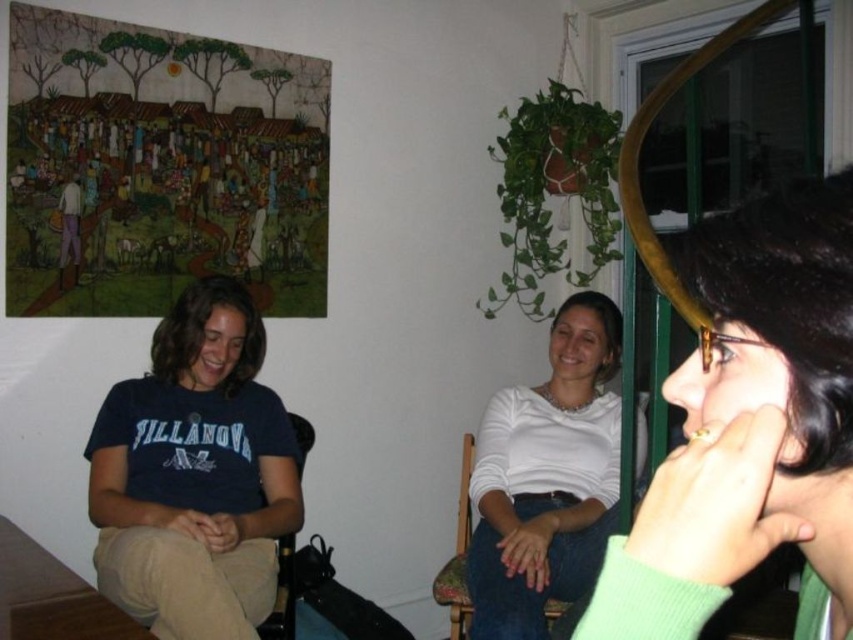
You are organizing a charity event and need to hang a large poster on the wall. The poster is the same size as the green matte sweater at right. Will it fit in the space currently occupied by the blue cotton shirt at left?

The green matte sweater at right occupies less space than the blue cotton shirt at left. Therefore, the poster, being the same size as the sweater, will not fit in the space occupied by the blue cotton shirt at left since it requires more space.